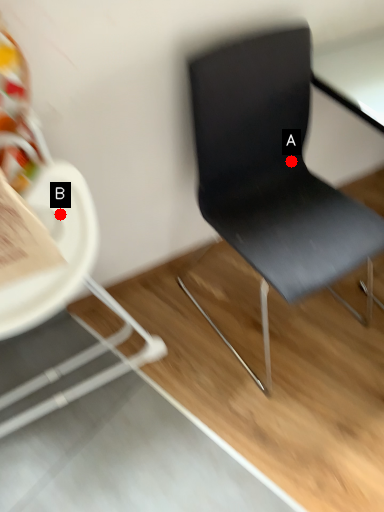
Question: Two points are circled on the image, labeled by A and B beside each circle. Which point is closer to the camera taking this photo?

Choices:
 (A) A is closer
 (B) B is closer

Answer: (B)